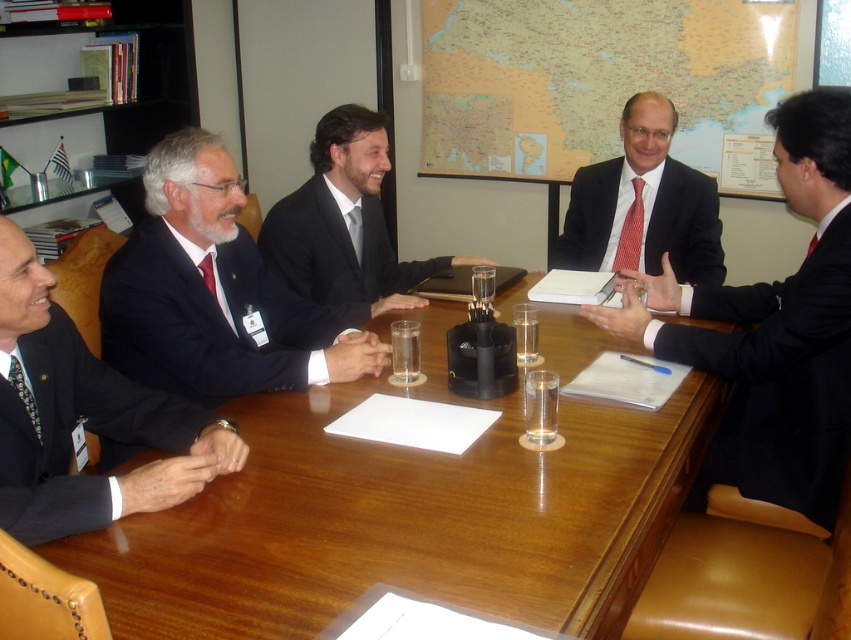
Is point (437, 346) closer to viewer compared to point (564, 240)?

Yes.

Where is `wooden table at center`? This screenshot has height=640, width=851. wooden table at center is located at coordinates (408, 516).

Does matte black suit at center come in front of black suit at center?

Yes, matte black suit at center is closer to the viewer.

Does matte black suit at center have a lesser height compared to black suit at center?

No, matte black suit at center is not shorter than black suit at center.

Identify the location of matte black suit at center. The image size is (851, 640). (774, 332).

Where is `dark blue suit at left`? This screenshot has height=640, width=851. dark blue suit at left is located at coordinates (87, 419).

Measure the distance between dark blue suit at left and camera.

dark blue suit at left is 3.98 feet from camera.

Find the location of a particular element. dark blue suit at left is located at coordinates (87, 419).